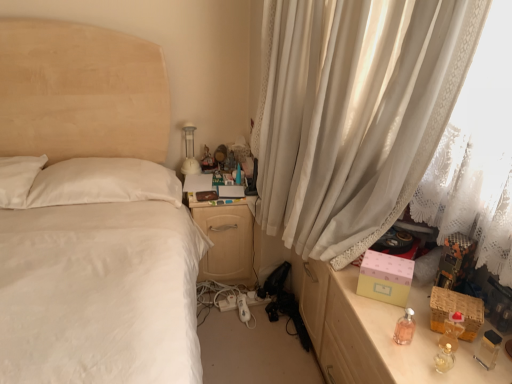
Question: Does translucent amber bottle at right, the 2th perfume in the left-to-right sequence, have a lesser height compared to pink glass perfume at lower right, which is the second perfume in right-to-left order?

Choices:
 (A) yes
 (B) no

Answer: (B)

Question: From the image's perspective, would you say translucent amber bottle at right, the 2th perfume in the left-to-right sequence, is shown under pink glass perfume at lower right, the first perfume in the left-to-right sequence?

Choices:
 (A) no
 (B) yes

Answer: (B)

Question: From the image's perspective, is translucent amber bottle at right, which is the first perfume from right to left, above pink glass perfume at lower right, the first perfume in the left-to-right sequence?

Choices:
 (A) no
 (B) yes

Answer: (A)

Question: Is translucent amber bottle at right, which is the first perfume from right to left, not near pink glass perfume at lower right, the first perfume in the left-to-right sequence?

Choices:
 (A) no
 (B) yes

Answer: (A)

Question: Is translucent amber bottle at right, which is the first perfume from right to left, to the right of pink glass perfume at lower right, which is the second perfume in right-to-left order, from the viewer's perspective?

Choices:
 (A) no
 (B) yes

Answer: (B)

Question: Is point (188, 132) positioned closer to the camera than point (360, 324)?

Choices:
 (A) closer
 (B) farther

Answer: (B)

Question: From their relative heights in the image, would you say white glossy table lamp at upper center is taller or shorter than matte pink box at right?

Choices:
 (A) short
 (B) tall

Answer: (A)

Question: Looking at the image, does white glossy table lamp at upper center seem bigger or smaller compared to matte pink box at right?

Choices:
 (A) big
 (B) small

Answer: (B)

Question: Looking at their shapes, would you say white glossy table lamp at upper center is wider or thinner than matte pink box at right?

Choices:
 (A) wide
 (B) thin

Answer: (B)

Question: Relative to light wood/wooden nightstand at center, is pink glass perfume at lower right, the first perfume in the left-to-right sequence, in front or behind?

Choices:
 (A) front
 (B) behind

Answer: (A)

Question: From the image's perspective, is pink glass perfume at lower right, the first perfume in the left-to-right sequence, located above or below light wood/wooden nightstand at center?

Choices:
 (A) below
 (B) above

Answer: (A)

Question: In terms of height, does pink glass perfume at lower right, which is the second perfume in right-to-left order, look taller or shorter compared to light wood/wooden nightstand at center?

Choices:
 (A) short
 (B) tall

Answer: (A)

Question: Considering the positions of point (409, 311) and point (199, 269), is point (409, 311) closer or farther from the camera than point (199, 269)?

Choices:
 (A) closer
 (B) farther

Answer: (A)

Question: Considering the positions of white sheer curtain at right and pink glass perfume at lower right, which is the second perfume in right-to-left order, in the image, is white sheer curtain at right bigger or smaller than pink glass perfume at lower right, which is the second perfume in right-to-left order,?

Choices:
 (A) small
 (B) big

Answer: (B)

Question: In the image, is white sheer curtain at right on the left side or the right side of pink glass perfume at lower right, which is the second perfume in right-to-left order?

Choices:
 (A) right
 (B) left

Answer: (B)